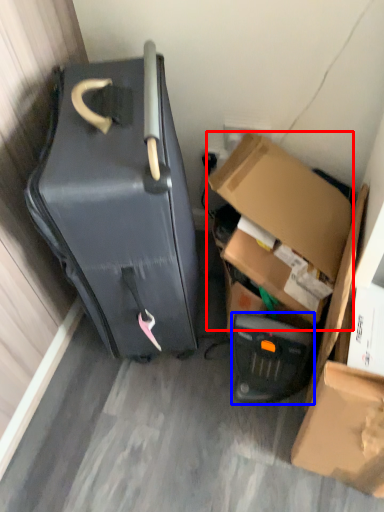
Question: Which object is further to the camera taking this photo, box (highlighted by a red box) or appliance (highlighted by a blue box)?

Choices:
 (A) box
 (B) appliance

Answer: (B)